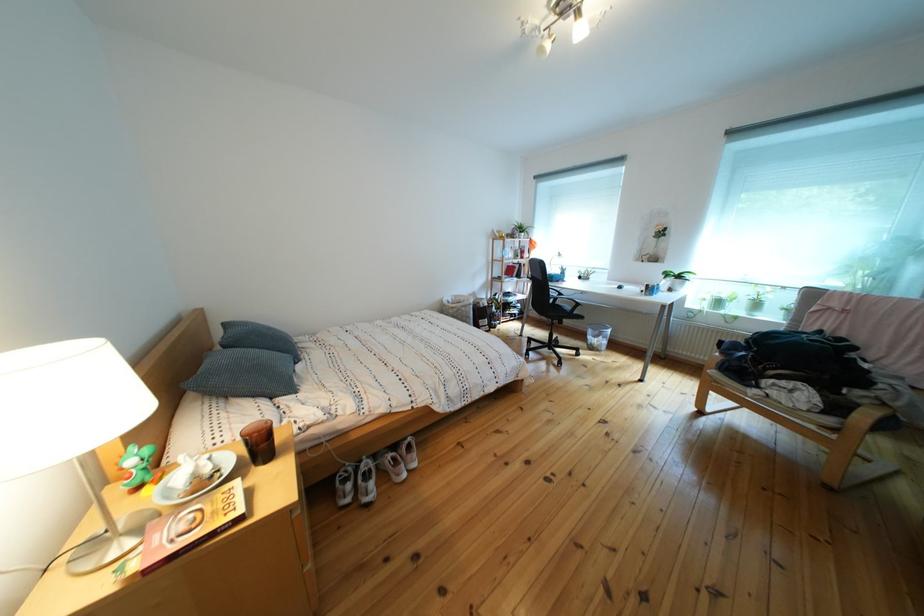
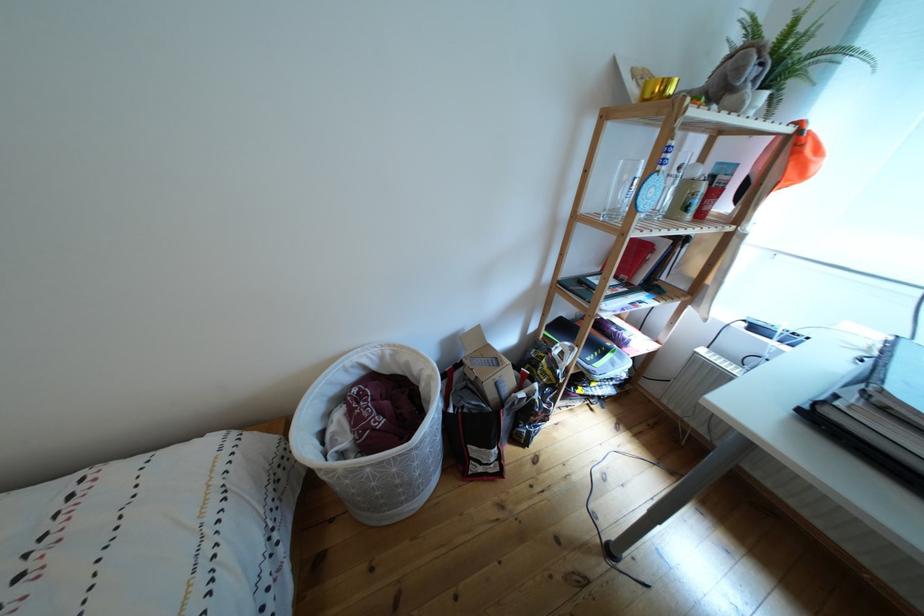
Where in the second image is the point corresponding to (x=527, y=238) from the first image?

(762, 77)